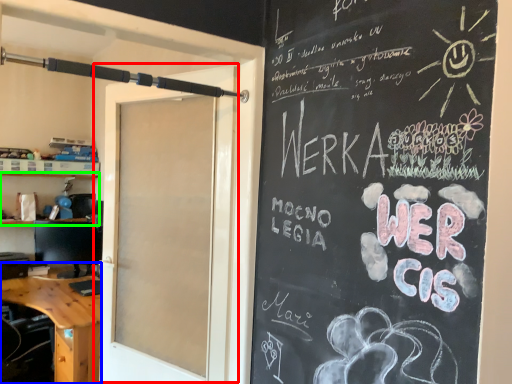
Question: Which object is positioned farthest from door (highlighted by a red box)? Select from desk (highlighted by a blue box) and shelf (highlighted by a green box).

Choices:
 (A) desk
 (B) shelf

Answer: (B)